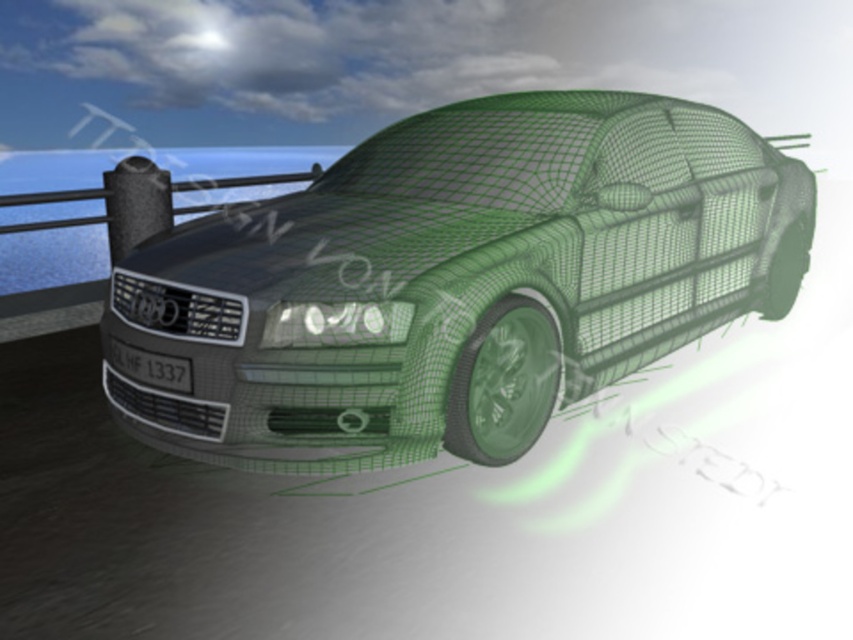
Can you confirm if green wireframe car at center is smaller than black plastic license plate at front?

No.

Which is behind, point (305, 464) or point (151, 387)?

The point (151, 387) is behind.

Locate an element on the screen. green wireframe car at center is located at coordinates (457, 280).